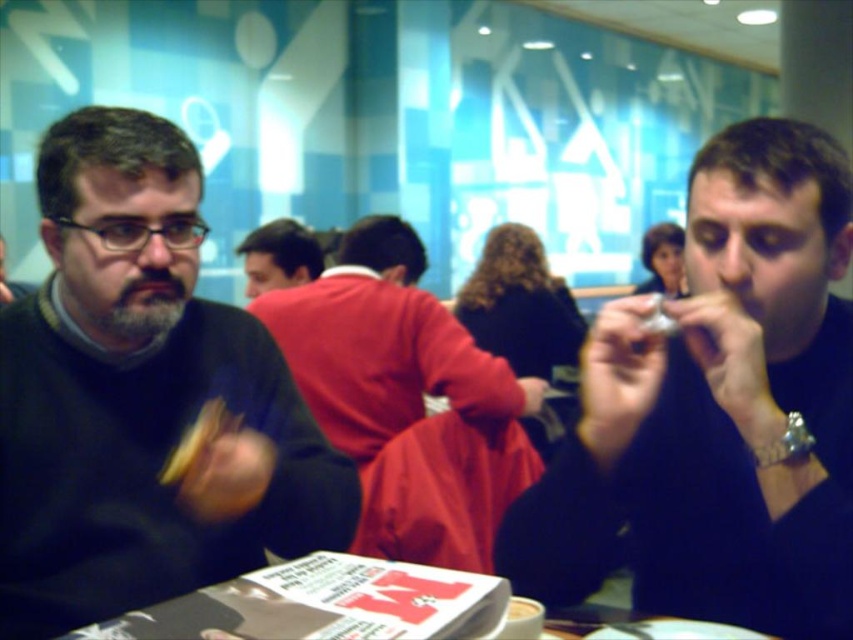
Find the location of a particular element. This screenshot has height=640, width=853. red matte sweater at center is located at coordinates (405, 400).

Which of these two, red matte sweater at center or white glossy table at lower center, stands shorter?

white glossy table at lower center is shorter.

Who is more forward, [461,324] or [332,616]?

Point [332,616]

The height and width of the screenshot is (640, 853). I want to click on red matte sweater at center, so click(x=405, y=400).

Is black matte shirt at right bigger than yellow matte bread at left?

Yes, black matte shirt at right is bigger than yellow matte bread at left.

Is black matte shirt at right behind yellow matte bread at left?

That is False.

Describe the element at coordinates (718, 412) in the screenshot. The height and width of the screenshot is (640, 853). I see `black matte shirt at right` at that location.

Where is `black matte shirt at right`? Image resolution: width=853 pixels, height=640 pixels. black matte shirt at right is located at coordinates pyautogui.click(x=718, y=412).

Can you confirm if black matte shirt at right is shorter than red matte sweater at center?

Correct, black matte shirt at right is not as tall as red matte sweater at center.

Identify the location of black matte shirt at right. tap(718, 412).